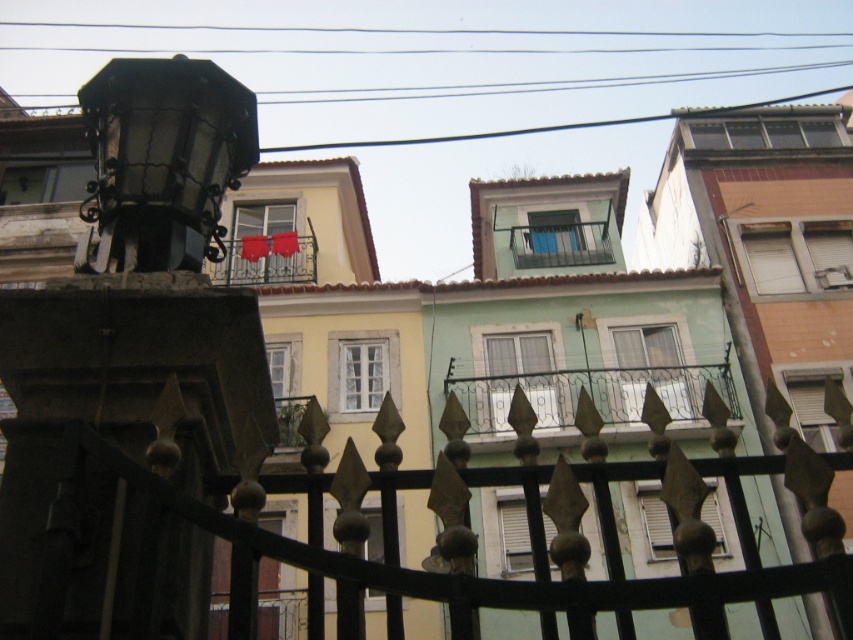
Looking at this image, you are a painter who needs to choose between two metallic balconies at center in the image to paint. The metallic gray balcony at center is narrower than the other metallic balcony at center. Which balcony should you choose if you want to paint the wider one?

You should choose the metallic balcony at center because it is wider than the metallic gray balcony at center.